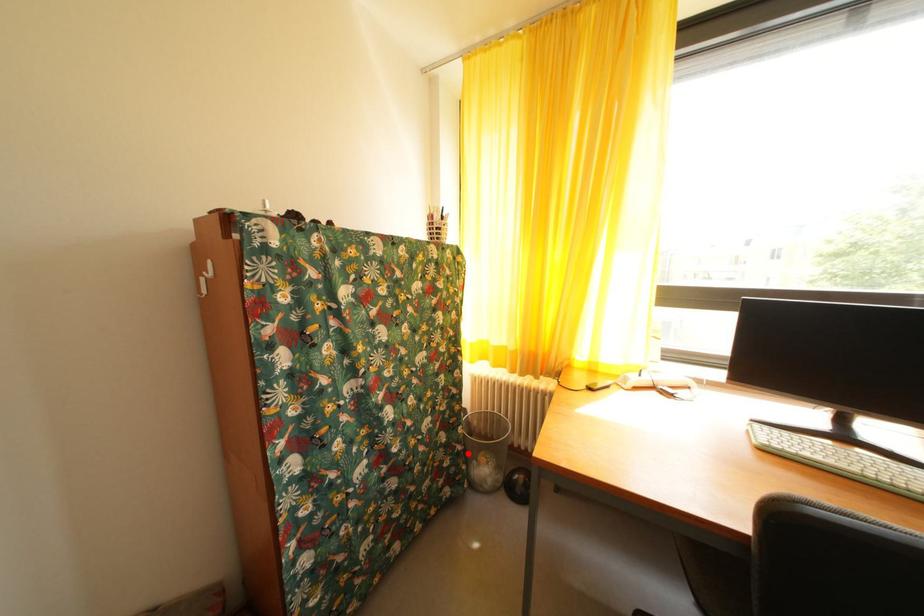
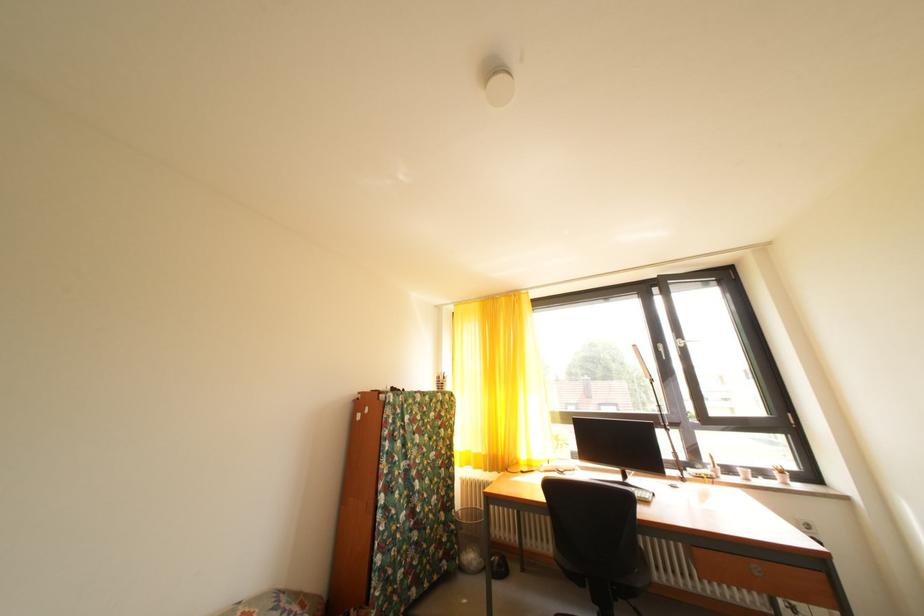
Question: A red point is marked in image1. In image2, is the corresponding 3D point closer to the camera or farther? Reply with the corresponding letter.

Choices:
 (A) The corresponding 3D point is closer.
 (B) The corresponding 3D point is farther.

Answer: (B)